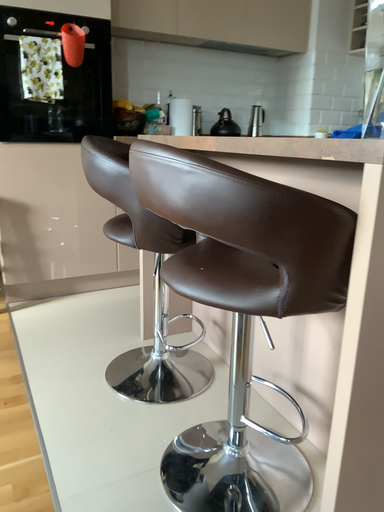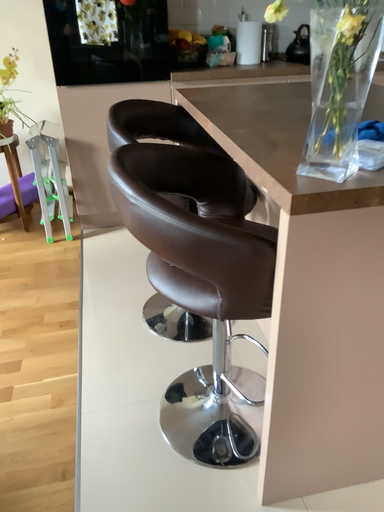
Question: How did the camera likely rotate when shooting the video?

Choices:
 (A) rotated right
 (B) rotated left

Answer: (B)